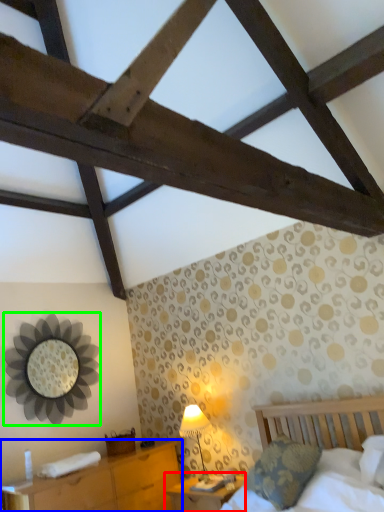
Question: Estimate the real-world distances between objects in this image. Which object is closer to nightstand (highlighted by a red box), nightstand (highlighted by a blue box) or mirror (highlighted by a green box)?

Choices:
 (A) nightstand
 (B) mirror

Answer: (A)